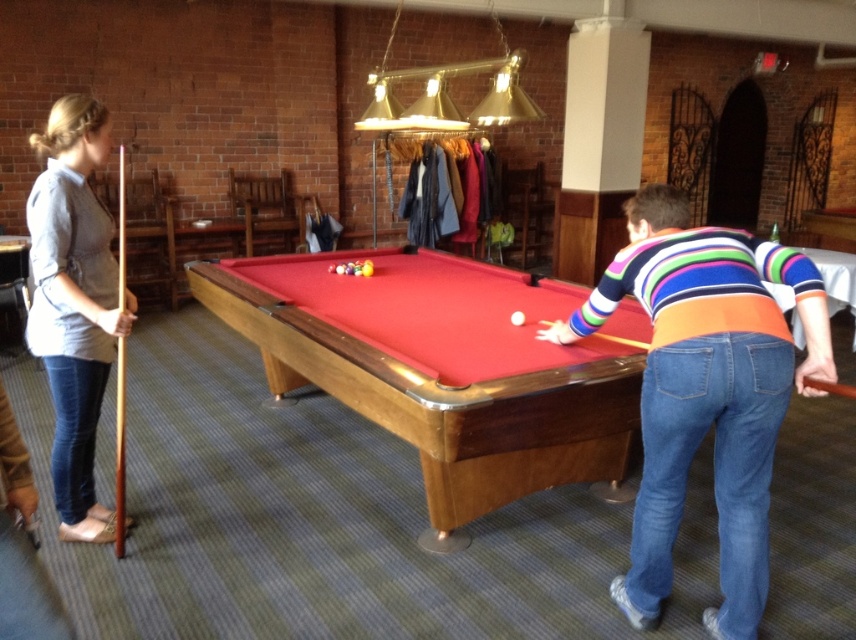
Does matte gray shirt at left have a greater width compared to orange fabric cue at center?

Yes, matte gray shirt at left is wider than orange fabric cue at center.

Does matte gray shirt at left have a larger size compared to orange fabric cue at center?

Yes.

Image resolution: width=856 pixels, height=640 pixels. What are the coordinates of `matte gray shirt at left` in the screenshot? It's located at (74, 301).

At what (x,y) coordinates should I click in order to perform the action: click on matte gray shirt at left. Please return your answer as a coordinate pair (x, y). This screenshot has width=856, height=640. Looking at the image, I should click on (74, 301).

Who is more forward, (687,320) or (69,419)?

Point (687,320)

Can you confirm if striped sweater at center is smaller than matte gray shirt at left?

No, striped sweater at center is not smaller than matte gray shirt at left.

Which is behind, point (758, 541) or point (73, 449)?

The point (73, 449) is more distant.

Locate an element on the screen. striped sweater at center is located at coordinates (706, 390).

Based on the photo, does striped sweater at center have a lesser width compared to wooden cue stick at left?

In fact, striped sweater at center might be wider than wooden cue stick at left.

Image resolution: width=856 pixels, height=640 pixels. What are the coordinates of `striped sweater at center` in the screenshot? It's located at (706, 390).